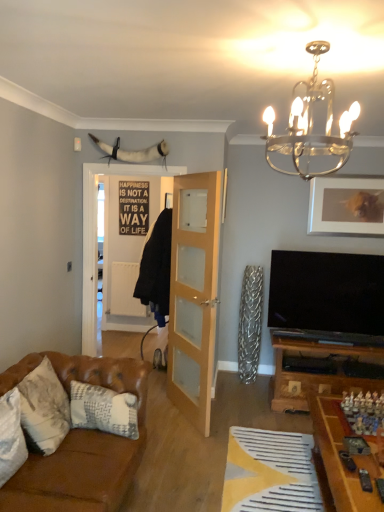
This screenshot has width=384, height=512. Find the location of `blank space situated above wooden game board at lower right (from a real-world perspective)`. blank space situated above wooden game board at lower right (from a real-world perspective) is located at coordinates tap(349, 440).